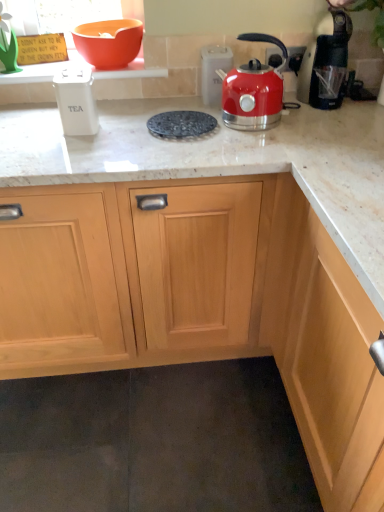
The image size is (384, 512). What are the coordinates of `free space to the left of black plastic coffee maker at upper right, the fourth kitchen appliance in the left-to-right sequence` in the screenshot? It's located at (290, 111).